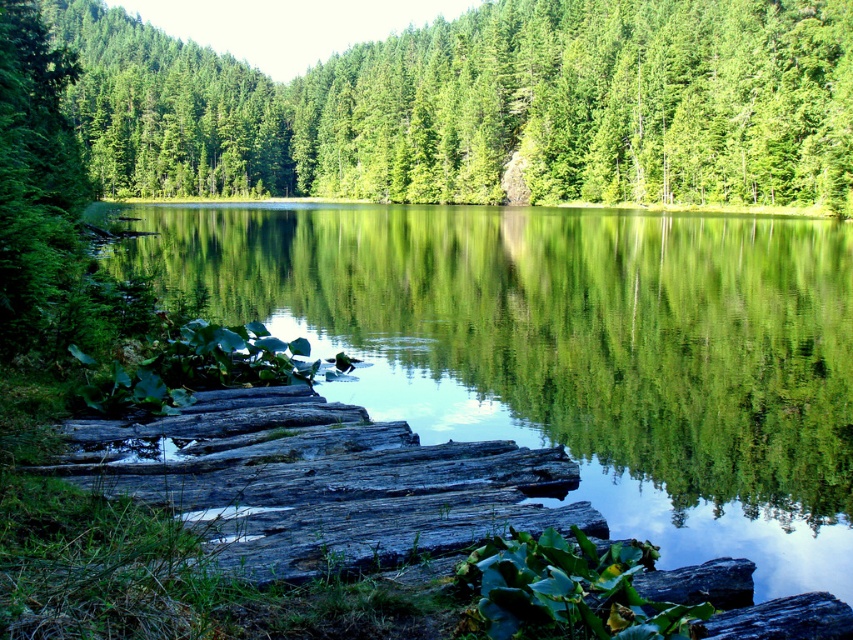
From the picture: Is smooth wooden dock at center behind green matte tree at center?

That is False.

The width and height of the screenshot is (853, 640). I want to click on smooth wooden dock at center, so click(x=573, y=349).